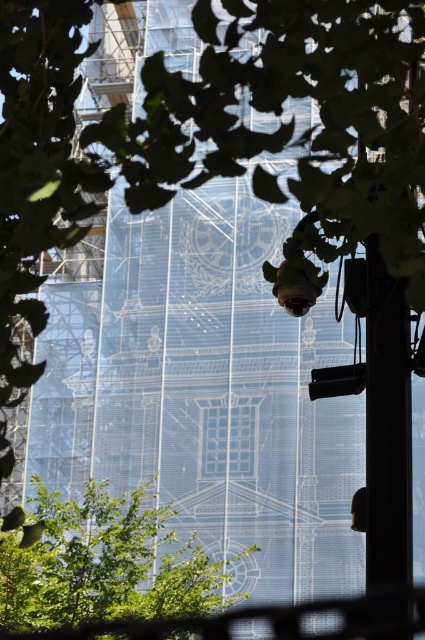
You are a photographer standing in front of the construction site. You notice two points marked on your camera screen at coordinates point [70,516] and point [404,561]. Which point is closer to your camera lens?

Point [70,516] is further to the camera than point [404,561], so the point closer to the camera lens is point [70,516].

You are a photographer trying to capture the building under construction. You notice the green leafy tree at center and the black matte pole at right are blocking parts of the view. Which object would you move closer to the camera to reduce the obstruction caused by the thinner one?

The green leafy tree at center is thinner than the black matte pole at right, so moving the thinner green leafy tree at center closer to the camera would reduce its obstruction of the view.